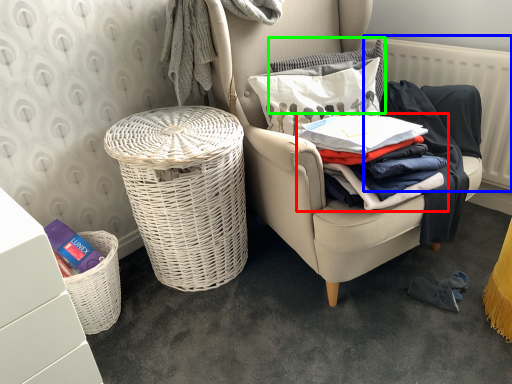
Question: Which is farther away from clothing (highlighted by a red box)? radiator (highlighted by a blue box) or pillow (highlighted by a green box)?

Choices:
 (A) radiator
 (B) pillow

Answer: (A)